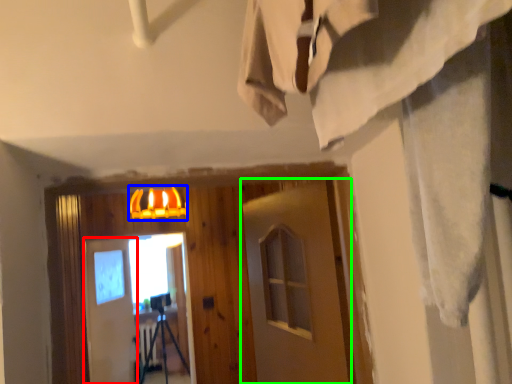
Question: Which is farther away from barn door (highlighted by a red box)? lamp (highlighted by a blue box) or barn door (highlighted by a green box)?

Choices:
 (A) lamp
 (B) barn door

Answer: (B)